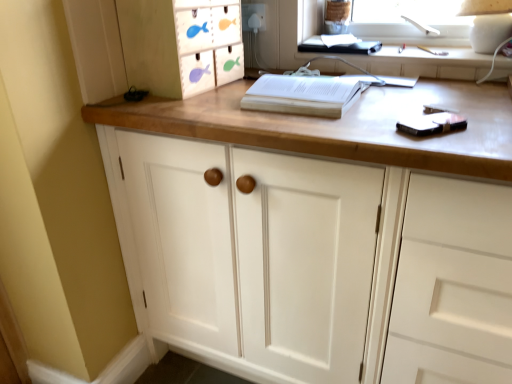
Question: From the image's perspective, is white paper at center beneath white plastic electric outlet at upper center?

Choices:
 (A) yes
 (B) no

Answer: (A)

Question: Is white paper at center not within white plastic electric outlet at upper center?

Choices:
 (A) yes
 (B) no

Answer: (A)

Question: From a real-world perspective, is white paper at center positioned over white plastic electric outlet at upper center based on gravity?

Choices:
 (A) yes
 (B) no

Answer: (B)

Question: From a real-world perspective, does white paper at center sit lower than white plastic electric outlet at upper center?

Choices:
 (A) no
 (B) yes

Answer: (B)

Question: From the image's perspective, is white paper at center above white plastic electric outlet at upper center?

Choices:
 (A) yes
 (B) no

Answer: (B)

Question: Can you confirm if white paper at center is smaller than white plastic electric outlet at upper center?

Choices:
 (A) no
 (B) yes

Answer: (A)

Question: Does white plastic electric outlet at upper center have a greater height compared to white wood cabinet at center?

Choices:
 (A) yes
 (B) no

Answer: (B)

Question: Does white plastic electric outlet at upper center come in front of white wood cabinet at center?

Choices:
 (A) yes
 (B) no

Answer: (B)

Question: Does white plastic electric outlet at upper center have a smaller size compared to white wood cabinet at center?

Choices:
 (A) yes
 (B) no

Answer: (A)

Question: Is white wood cabinet at center located within white plastic electric outlet at upper center?

Choices:
 (A) yes
 (B) no

Answer: (B)

Question: Does white plastic electric outlet at upper center have a larger size compared to white wood cabinet at center?

Choices:
 (A) yes
 (B) no

Answer: (B)

Question: Is white plastic electric outlet at upper center far away from white wood cabinet at center?

Choices:
 (A) no
 (B) yes

Answer: (A)

Question: Are wooden fish-themed drawer at upper left and white paper at center far apart?

Choices:
 (A) no
 (B) yes

Answer: (A)